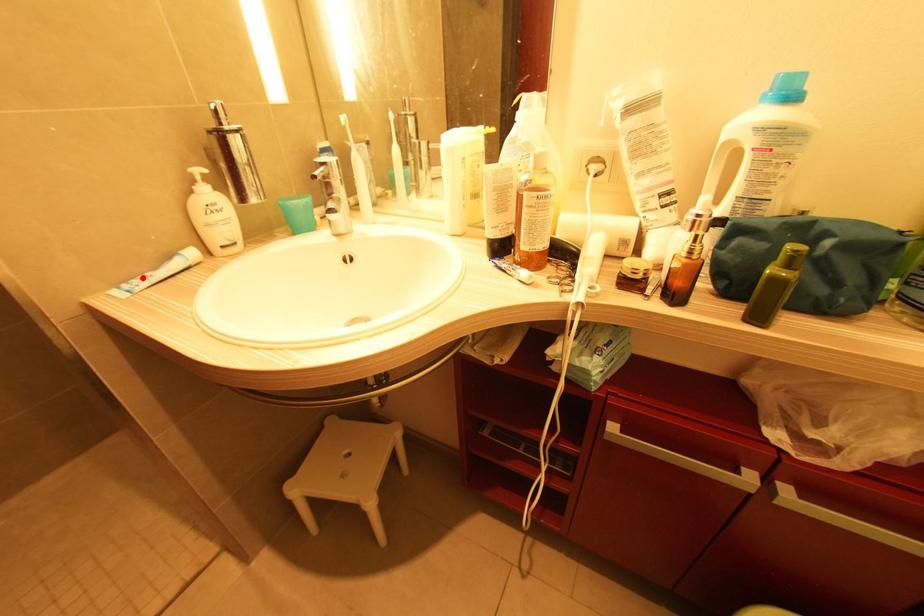
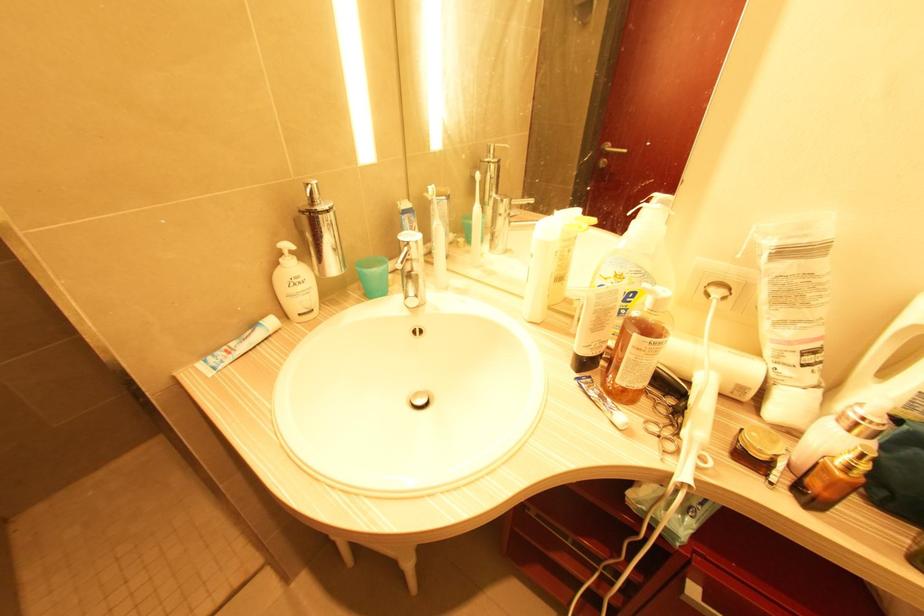
The point at the highlighted location is marked in the first image. Where is the corresponding point in the second image?

(226, 349)